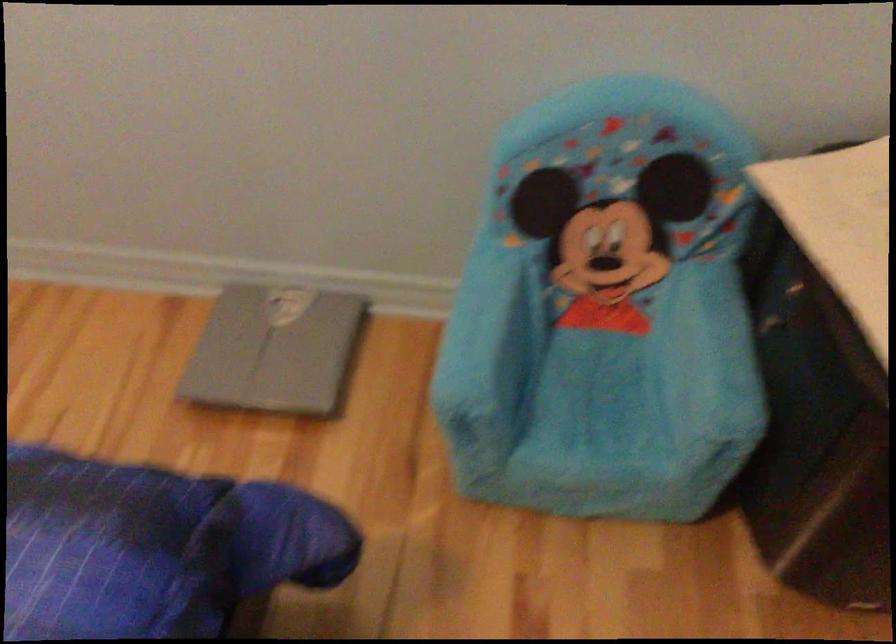
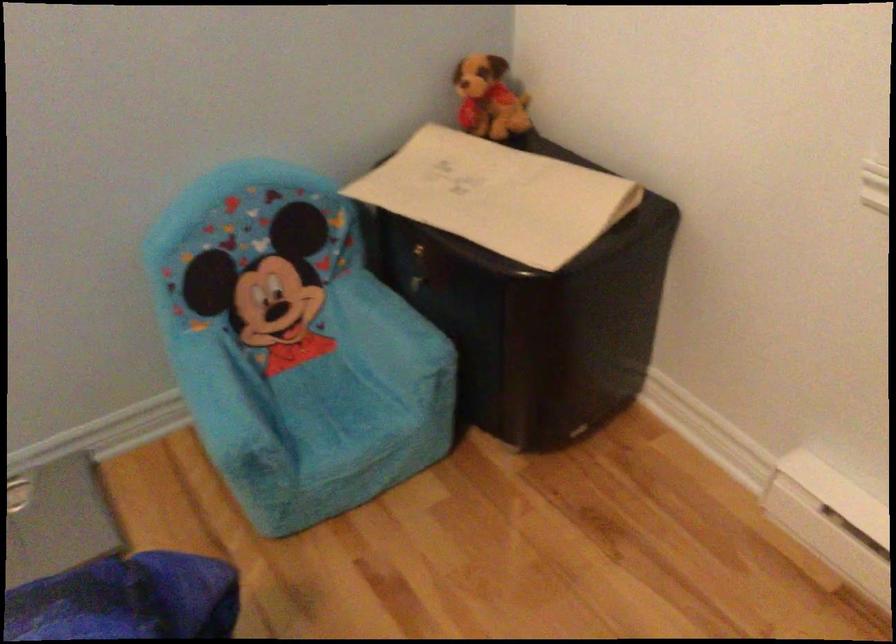
The point at (765, 335) is marked in the first image. Where is the corresponding point in the second image?

(419, 292)